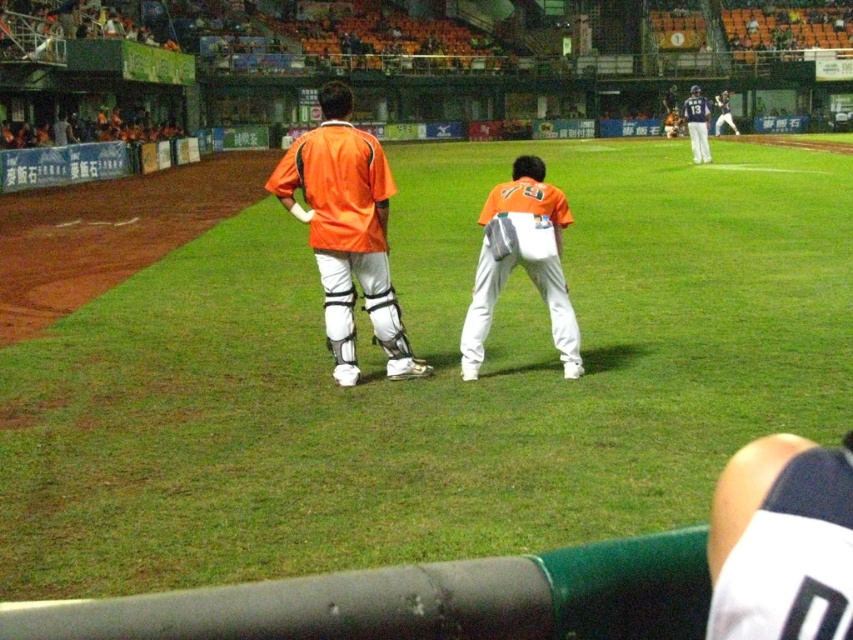
Can you confirm if orange matte baseball uniform at center is positioned to the left of orange jersey at center?

Correct, you'll find orange matte baseball uniform at center to the left of orange jersey at center.

Does orange matte baseball uniform at center have a greater height compared to orange jersey at center?

In fact, orange matte baseball uniform at center may be shorter than orange jersey at center.

Which is behind, point (335, 355) or point (723, 93)?

Positioned behind is point (723, 93).

Locate an element on the screen. Image resolution: width=853 pixels, height=640 pixels. orange matte baseball uniform at center is located at coordinates (347, 237).

This screenshot has height=640, width=853. What do you see at coordinates (347, 237) in the screenshot?
I see `orange matte baseball uniform at center` at bounding box center [347, 237].

Which is more to the left, orange matte baseball uniform at center or white matte uniform at upper right?

orange matte baseball uniform at center

Identify the location of orange matte baseball uniform at center. (347, 237).

Does white matte pants at center have a greater width compared to orange jersey at center?

Yes.

Image resolution: width=853 pixels, height=640 pixels. I want to click on white matte pants at center, so point(431,378).

Does point (294, 470) come in front of point (722, 104)?

Yes, point (294, 470) is closer to viewer.

Identify the location of white matte pants at center. This screenshot has height=640, width=853. (431, 378).